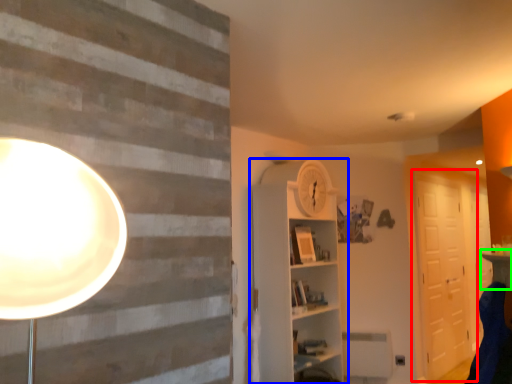
Question: Which is nearer to the barn door (highlighted by a red box)? shelf (highlighted by a blue box) or table (highlighted by a green box).

Choices:
 (A) shelf
 (B) table

Answer: (A)